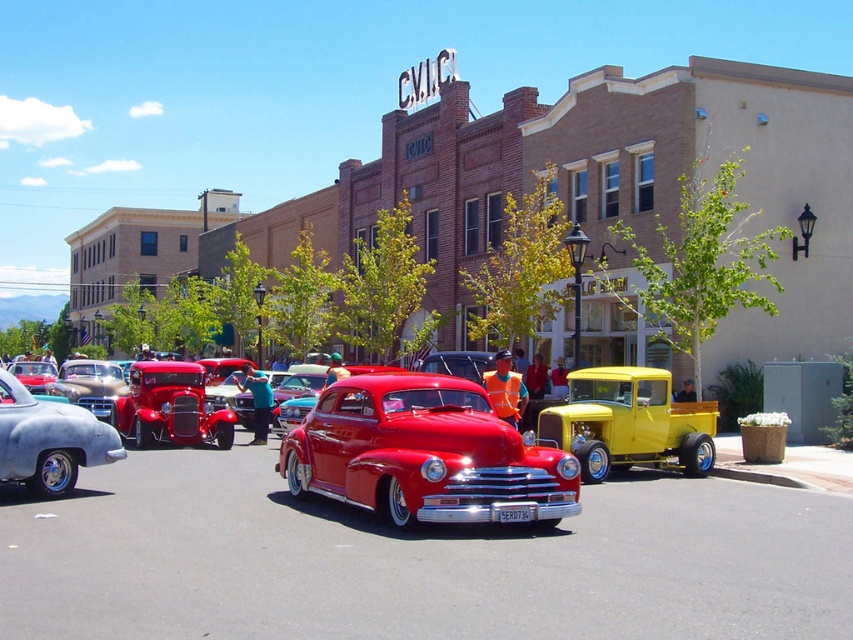
You are standing at the point with coordinates (426, 454) in the car show image. What object is located exactly at your current position?

The glossy metal car at center is located exactly at point (426, 454).

You are a photographer at the car show and want to capture both the glossy metal car at center and the yellow wood pickup truck at center in a single shot. Based on their positions, can you tell which one is closer to the camera?

The glossy metal car at center is located below the yellow wood pickup truck at center, which means it is closer to the camera.

You are standing at the edge of the car show and see the glossy metal car at center and the yellow wood pickup truck at center. Which car is positioned more to the left side of the scene?

The glossy metal car at center is positioned to the left of the yellow wood pickup truck at center, so it is more to the left side of the scene.